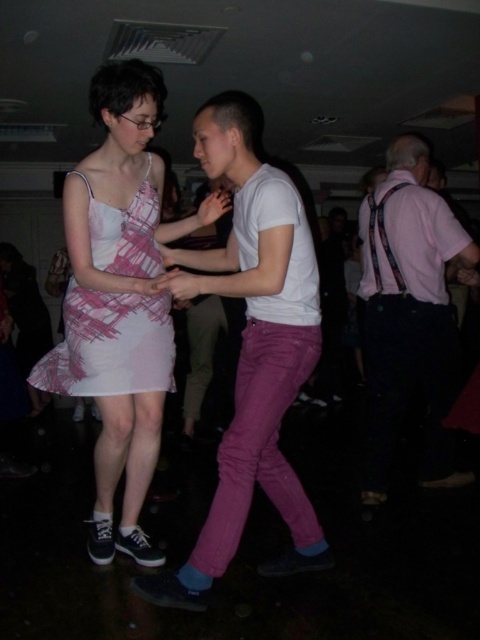
You are at a social event and want to take a photo of two points in the scene. The first point is at coordinates point (120, 104) and the second is at point (142, 369). Which point will appear larger in your photo?

Point (120, 104) is closer to the camera than point (142, 369), so it will appear larger in the photo.

You are at a social event and want to take a photo of the point at coordinates (80, 240). The camera you have can focus on objects within 5 feet. Based on the scene description, will the camera be able to focus on that point?

The distance between the point at coordinates (80, 240) and the camera is 6.52 feet. Since the camera can only focus within 5 feet, it will not be able to focus on that point.

You are a photographer at the event and want to capture a photo of both the pink fabric dress at center and the purple cotton pants at center in the same frame. Your camera has a minimum focus distance of 12 inches. Will you be able to take the photo without moving closer?

The distance between the pink fabric dress at center and the purple cotton pants at center is 12.46 inches. Since this is slightly more than the camera minimum focus distance of 12 inches, you can take the photo without moving closer.